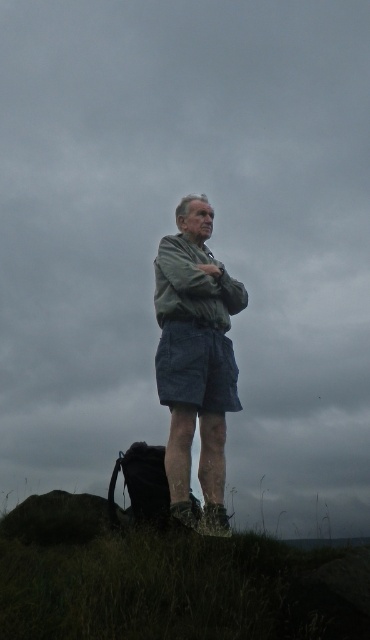
Looking at this image, you are a photographer trying to capture the man in the scene. You want to place your camera at the point with coordinates point (167, 580). What is the object at this location where you should place your camera?

The point (167, 580) corresponds to green grassy at lower center, so you should place your camera on the green grassy area at lower center.

You are a photographer trying to capture the man in the scene. You want to focus on the green fabric shirt at center while ensuring the green grassy at lower center is visible in the background. Which object should you position closer to the camera to achieve this?

To focus on the green fabric shirt at center while keeping the green grassy at lower center in the background, position the green fabric shirt at center closer to the camera. This way, the shirt will be in focus, and the grassy area will naturally fall into the background.

In the scene shown: You are taking a photo of the older man in the scene. You want to focus on the point closer to the camera between the two points labeled point (21, 560) and point (173, 241). Which point should you focus on?

You should focus on point (21, 560) because it is closer to the camera than point (173, 241).